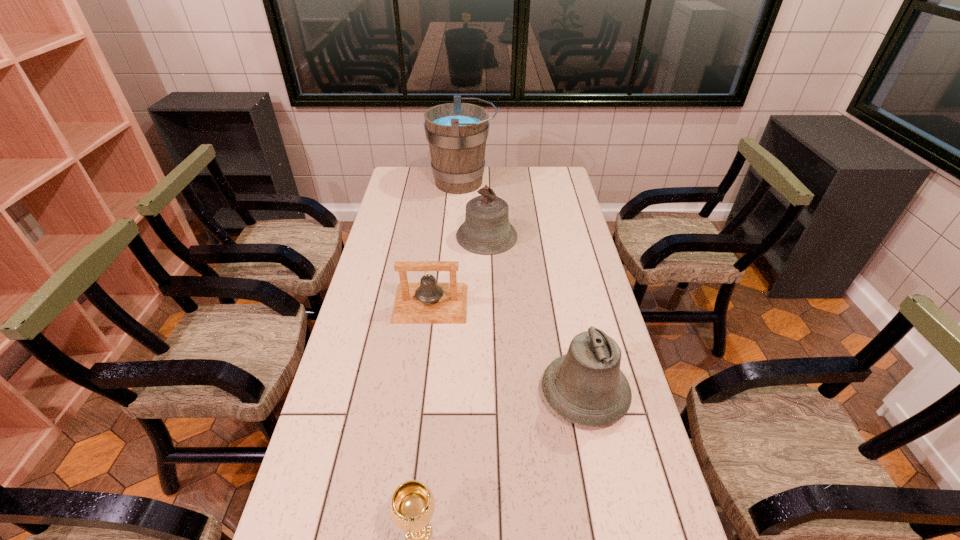
Find the location of a particular element. This screenshot has height=540, width=960. blank space that satisfies the following two spatial constraints: 1. with a handle on the side of the tallest object; 2. on the right side of the nearest bell is located at coordinates (450, 394).

You are a GUI agent. You are given a task and a screenshot of the screen. Output one action in this format:
    pyautogui.click(x=<x>, y=<y>)
    Task: Click on the vacant region that satisfies the following two spatial constraints: 1. with a handle on the side of the farthest object; 2. on the left side of the second farthest object
    This screenshot has height=540, width=960.
    Given the screenshot: What is the action you would take?
    pyautogui.click(x=459, y=237)

Where is `free location that satisfies the following two spatial constraints: 1. with a handle on the side of the farthest object; 2. on the left side of the farthest bell`? This screenshot has width=960, height=540. free location that satisfies the following two spatial constraints: 1. with a handle on the side of the farthest object; 2. on the left side of the farthest bell is located at coordinates (459, 237).